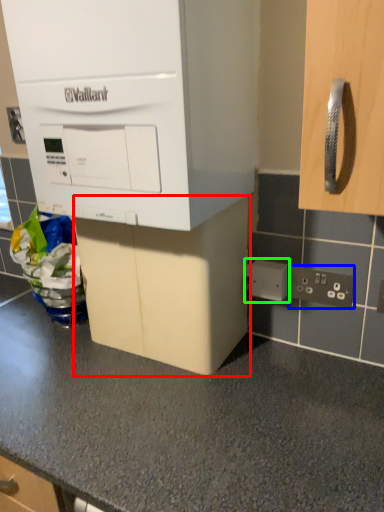
Question: Which object is the farthest from cabinetry (highlighted by a red box)? Choose among these: electric outlet (highlighted by a blue box) or electric outlet (highlighted by a green box).

Choices:
 (A) electric outlet
 (B) electric outlet

Answer: (A)